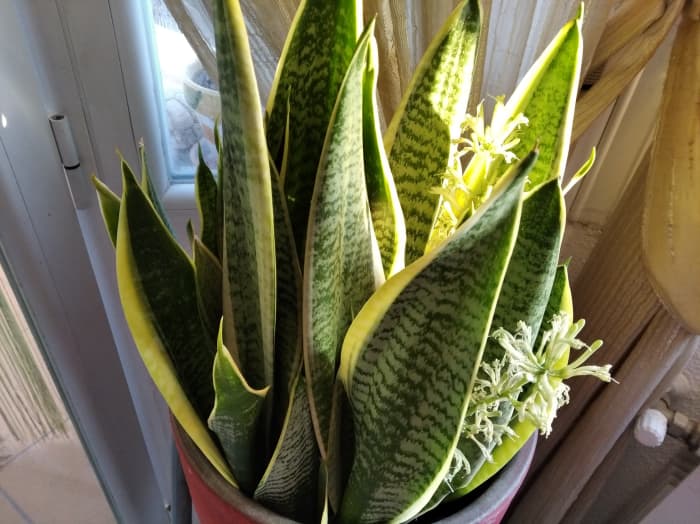
This screenshot has height=524, width=700. Find the location of `rightmost plant leaf`. rightmost plant leaf is located at coordinates (556, 291).